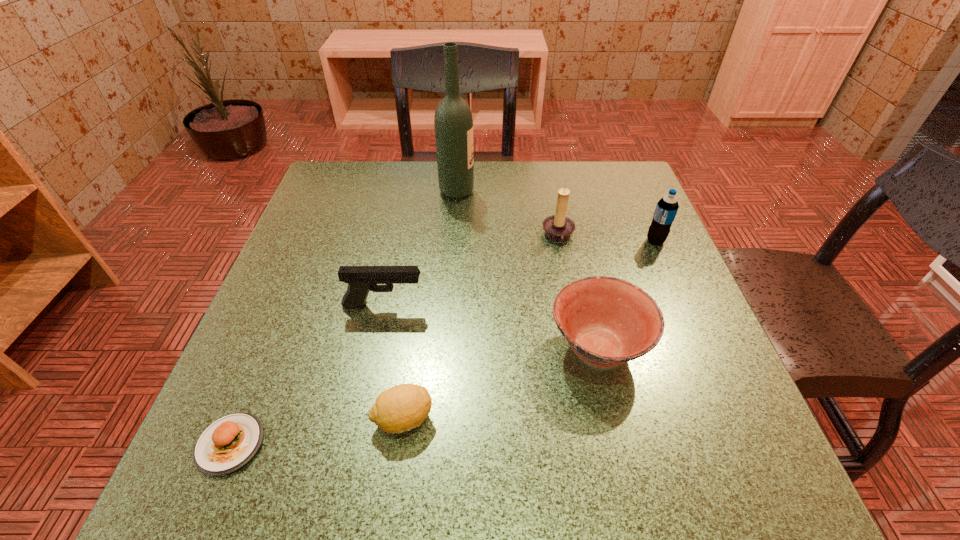
I want to click on food situated at the near edge, so click(226, 445).

Where is `pistol at the left edge`? The image size is (960, 540). pistol at the left edge is located at coordinates (361, 279).

Where is `food that is at the left edge`? This screenshot has width=960, height=540. food that is at the left edge is located at coordinates (226, 445).

Where is `soda bottle that is at the right edge`? This screenshot has height=540, width=960. soda bottle that is at the right edge is located at coordinates (667, 207).

Identify the location of bowl that is at the right edge. (607, 321).

The width and height of the screenshot is (960, 540). Find the location of `object that is at the near left corner`. object that is at the near left corner is located at coordinates (226, 445).

The image size is (960, 540). In the image, there is a desktop. In order to click on vacant area at the far edge in this screenshot , I will do `click(494, 202)`.

In order to click on free space at the near edge of the desktop in this screenshot , I will do `click(577, 493)`.

Where is `free region at the left edge`? free region at the left edge is located at coordinates (230, 412).

Image resolution: width=960 pixels, height=540 pixels. In order to click on vacant area at the right edge in this screenshot , I will do `click(750, 429)`.